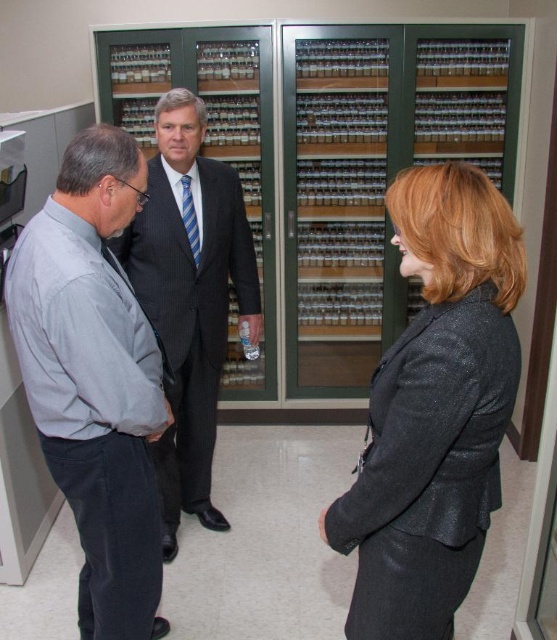
You are a photographer trying to capture a group photo of the gray shirt at left and the dark gray pinstripe suit at center. If you want to ensure both individuals are in focus, which person should you adjust the camera focus on first?

The gray shirt at left has a lesser width compared to dark gray pinstripe suit at center. Since the gray shirt at left is narrower, you should focus on the dark gray pinstripe suit at center first to ensure both are in focus.

Consider the image. Based on the scene description, which clothing item is shorter in height between the sparkly black blazer at center and the dark gray pinstripe suit at center?

The sparkly black blazer at center is not as tall as the dark gray pinstripe suit at center, so the sparkly black blazer at center is shorter in height.